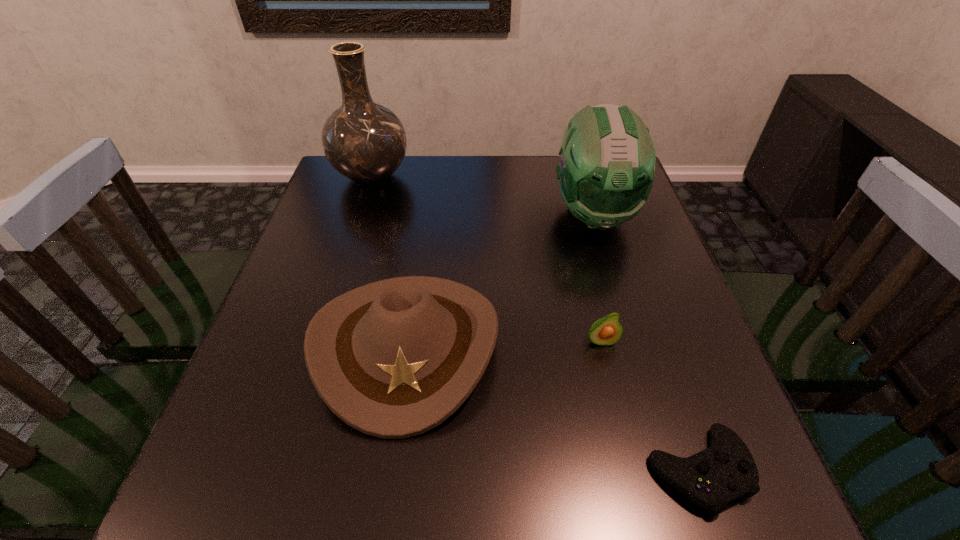
This screenshot has width=960, height=540. In order to click on vacant region that satisfies the following two spatial constraints: 1. on the visor of the fourth shortest object; 2. on the right side of the control in this screenshot , I will do `click(670, 470)`.